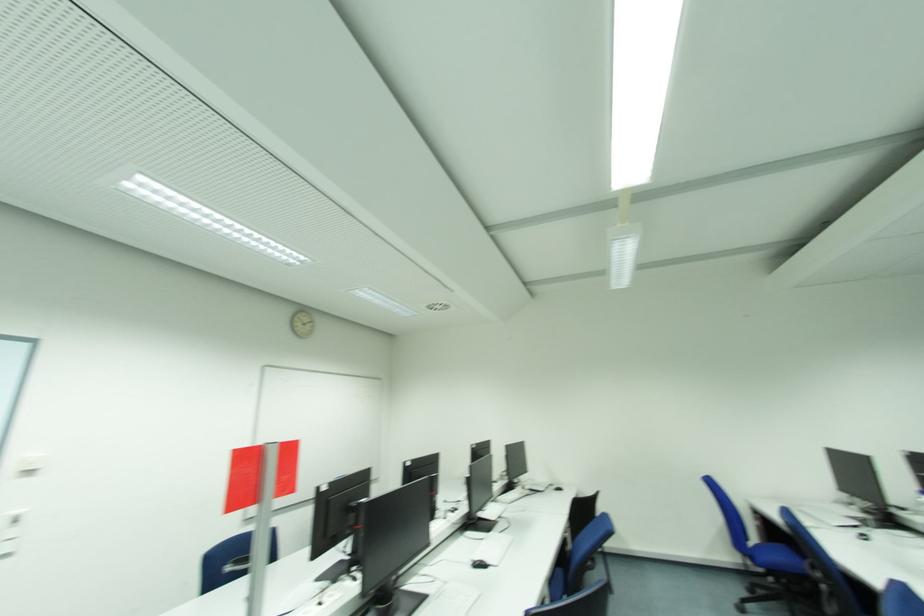
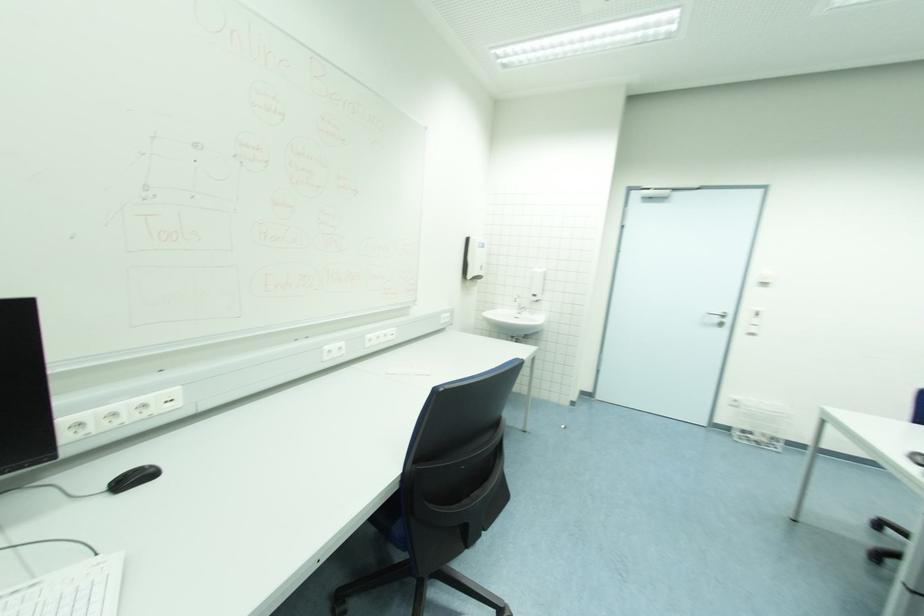
Question: The camera is either moving clockwise (left) or counter-clockwise (right) around the object. The first image is from the beginning of the video and the second image is from the end. Is the camera moving left or right when shooting the video?

Choices:
 (A) Left
 (B) Right

Answer: (B)